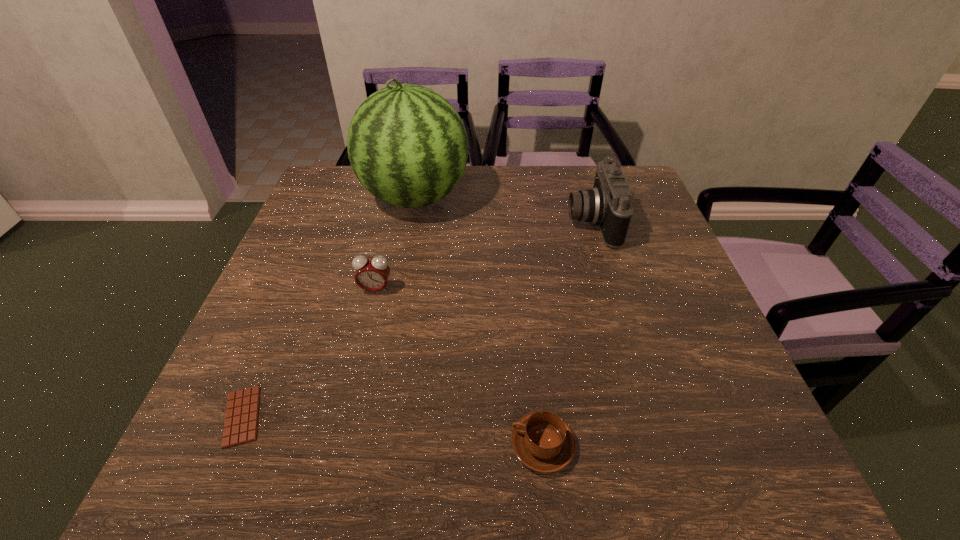
Locate an element on the screen. vacant region located on the front-facing side of the camera is located at coordinates (508, 222).

Identify the location of free location located 0.360m on the front-facing side of the camera. (433, 222).

You are a GUI agent. You are given a task and a screenshot of the screen. Output one action in this format:
    pyautogui.click(x=<x>, y=<y>)
    Task: Click on the free space located on the front-facing side of the camera
    
    Given the screenshot: What is the action you would take?
    (538, 222)

Find the location of a particular element. This screenshot has height=540, width=960. vacant area located on the clock face of the third farthest object is located at coordinates (344, 424).

This screenshot has height=540, width=960. I want to click on free region located on the side of the second shortest object with the handle, so click(x=356, y=445).

Locate an element on the screen. vacant area situated 0.390m on the side of the second shortest object with the handle is located at coordinates (278, 445).

Identify the location of free location located 0.170m on the side of the second shortest object with the handle. This screenshot has width=960, height=540. (410, 445).

Where is `blank space located 0.170m on the right of the leftmost object`? This screenshot has height=540, width=960. blank space located 0.170m on the right of the leftmost object is located at coordinates (362, 416).

Locate an element on the screen. Image resolution: width=960 pixels, height=540 pixels. watermelon that is at the far edge is located at coordinates (407, 145).

The image size is (960, 540). What are the coordinates of `camera that is at the far edge` in the screenshot? It's located at (608, 205).